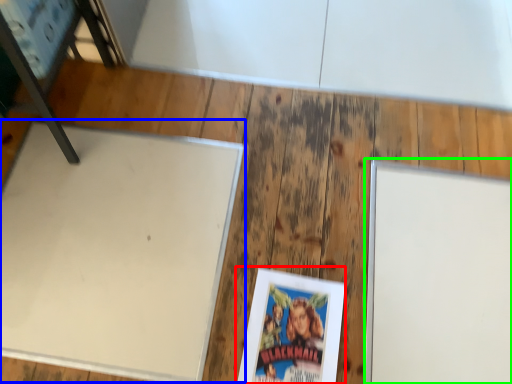
Question: Which object is positioned closest to paperback book (highlighted by a red box)? Select from table (highlighted by a blue box) and bulletin board (highlighted by a green box).

Choices:
 (A) table
 (B) bulletin board

Answer: (B)